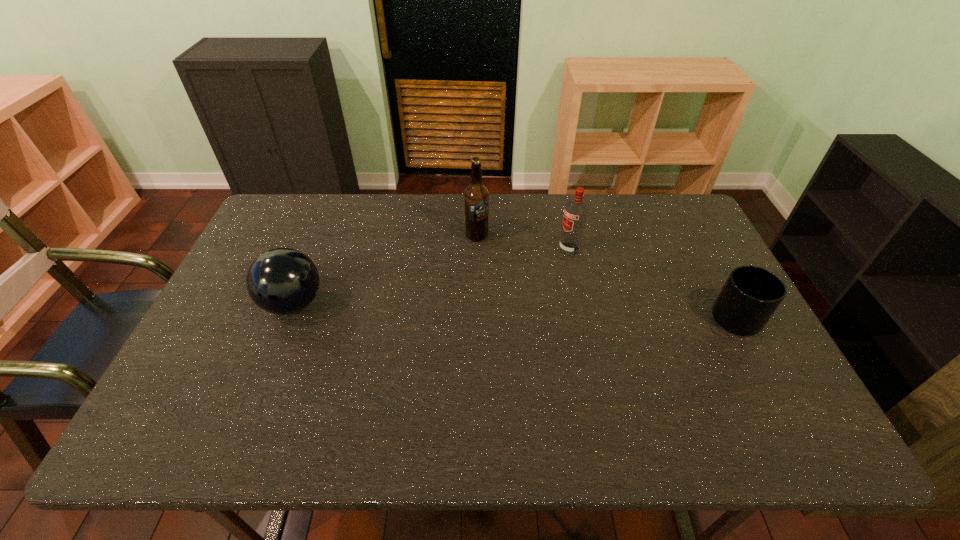
Locate an element on the screen. This screenshot has height=540, width=960. the leftmost object is located at coordinates (282, 281).

You are a GUI agent. You are given a task and a screenshot of the screen. Output one action in this format:
    pyautogui.click(x=<x>, y=<y>)
    Task: Click on the bowling ball
    
    Given the screenshot: What is the action you would take?
    pyautogui.click(x=282, y=281)

Where is `mug`? Image resolution: width=960 pixels, height=540 pixels. mug is located at coordinates (750, 296).

The width and height of the screenshot is (960, 540). Identify the location of the shortest object. (750, 296).

This screenshot has width=960, height=540. Identify the location of the second tallest object. (575, 215).

The image size is (960, 540). Find the location of `vodka`. vodka is located at coordinates (575, 215).

Locate an element on the screen. This screenshot has height=540, width=960. the tallest object is located at coordinates (476, 197).

I want to click on beer bottle, so [x=476, y=197].

Identify the location of free space located on the side of the leftmost object with the finger holes. (344, 303).

Image resolution: width=960 pixels, height=540 pixels. What are the coordinates of `vacant space located 0.140m on the front label of the second tallest object` in the screenshot? It's located at (526, 272).